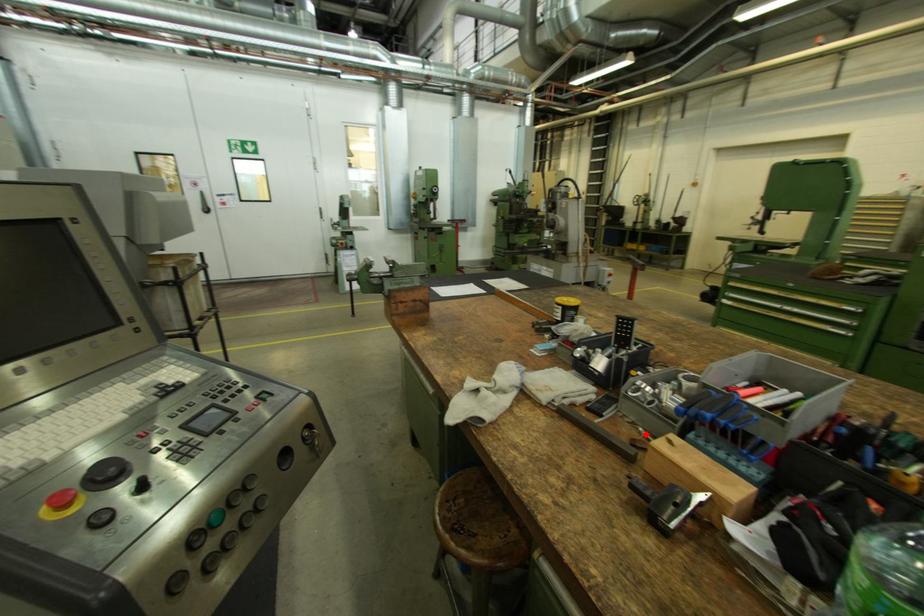
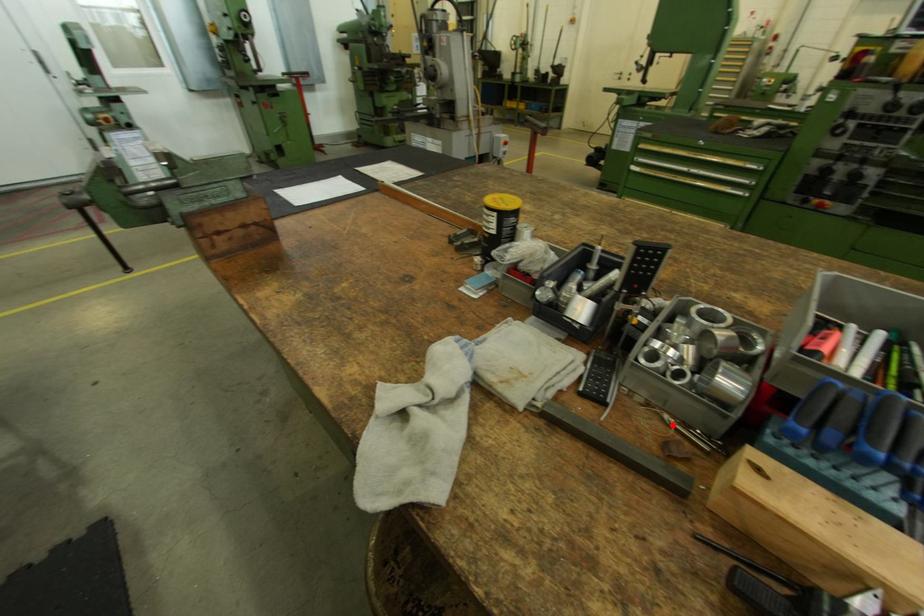
I am providing you with two images of the same scene from different viewpoints. A red point is marked on the first image and another point is marked on the second image. Do the highlighted points in image1 and image2 indicate the same real-world spot?

Yes